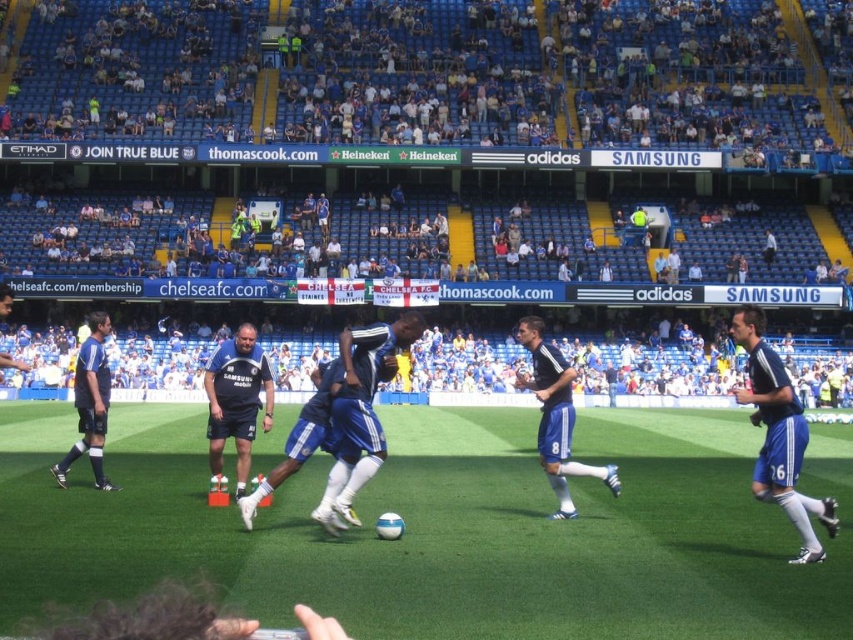
Who is higher up, blue fabric shorts at right or blue jersey at left?

blue jersey at left is above.

Can you confirm if blue fabric shorts at right is wider than blue jersey at left?

No, blue fabric shorts at right is not wider than blue jersey at left.

At what (x,y) coordinates should I click in order to perform the action: click on blue fabric shorts at right. Please return your answer as a coordinate pair (x, y). Looking at the image, I should click on (779, 435).

Is dark blue jersey at center taller than blue jersey at left?

In fact, dark blue jersey at center may be shorter than blue jersey at left.

Identify the location of dark blue jersey at center. The image size is (853, 640). (236, 401).

Who is more distant from viewer, [370,442] or [560,356]?

Point [560,356]

Between blue matte soccer player at center and blue fabric jersey at center, which one is positioned lower?

blue fabric jersey at center is below.

Between point (341, 516) and point (547, 433), which one is positioned in front?

Positioned in front is point (341, 516).

This screenshot has width=853, height=640. Find the location of `blue matte soccer player at center`. blue matte soccer player at center is located at coordinates (360, 413).